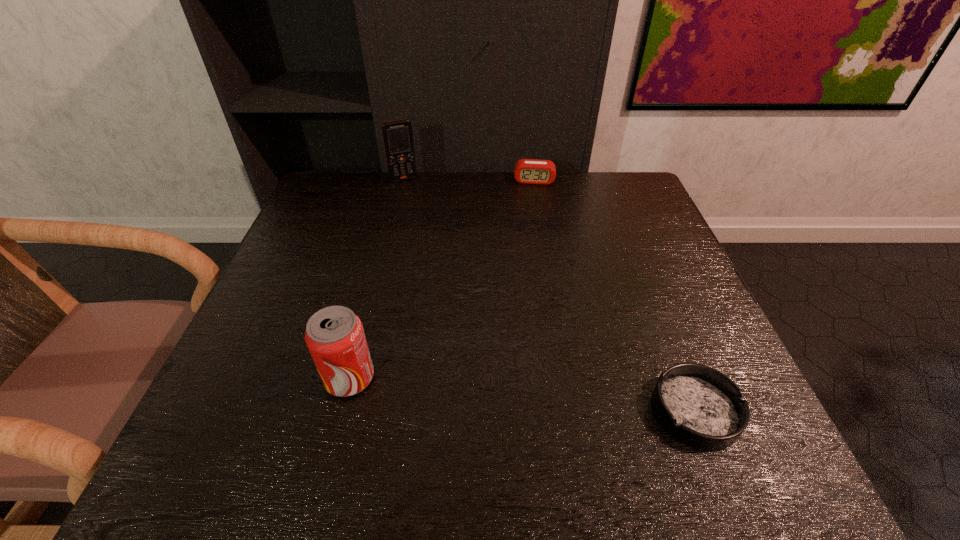
Identify the location of free space between the second shortest object and the soda can. (442, 279).

Locate an element on the screen. free space between the ashtray and the cellular telephone is located at coordinates (549, 295).

Identify the location of empty space between the third object from left to right and the second tallest object. (442, 279).

Find the location of a particular element. The height and width of the screenshot is (540, 960). free spot between the rightmost object and the cellular telephone is located at coordinates (549, 295).

This screenshot has height=540, width=960. Identify the location of free point between the soda can and the rightmost object. (522, 394).

The width and height of the screenshot is (960, 540). Find the location of `object that ranks as the third closest to the cellular telephone`. object that ranks as the third closest to the cellular telephone is located at coordinates (699, 406).

Identify the location of the closest object to the second object from right to left. (398, 139).

You are a GUI agent. You are given a task and a screenshot of the screen. Output one action in this format:
    pyautogui.click(x=<x>, y=<y>)
    Task: Click on the vacant area in the image that satisfies the following two spatial constraints: 1. on the front side of the cellular telephone; 2. on the left side of the rightmost object
    Image resolution: width=960 pixels, height=540 pixels.
    Given the screenshot: What is the action you would take?
    pyautogui.click(x=348, y=411)

Where is `vacant space that satisfies the following two spatial constraints: 1. on the back side of the cellular telephone; 2. on the left side of the soda can`? The image size is (960, 540). vacant space that satisfies the following two spatial constraints: 1. on the back side of the cellular telephone; 2. on the left side of the soda can is located at coordinates (399, 179).

This screenshot has height=540, width=960. In order to click on free location that satisfies the following two spatial constraints: 1. on the back side of the cellular telephone; 2. on the left side of the third shortest object in this screenshot , I will do `click(399, 179)`.